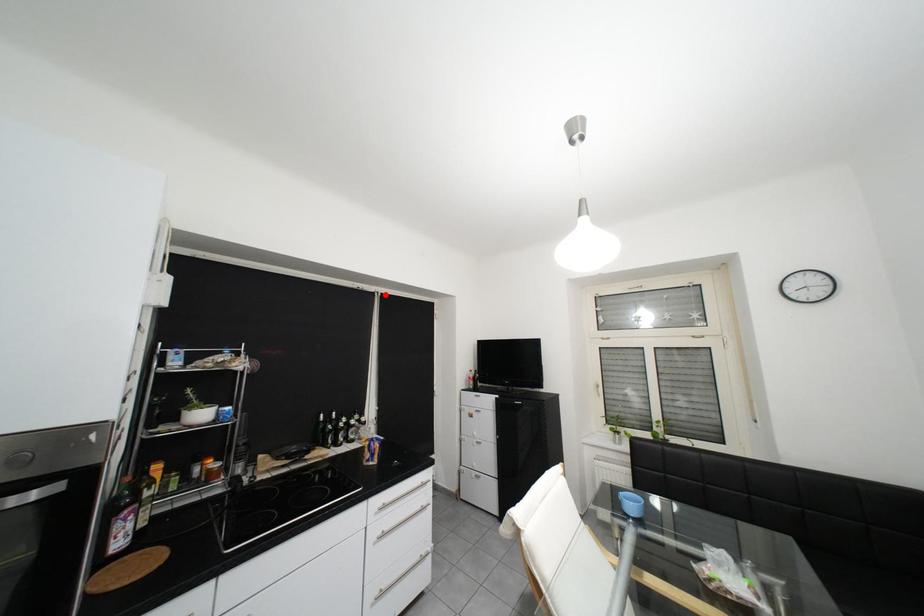
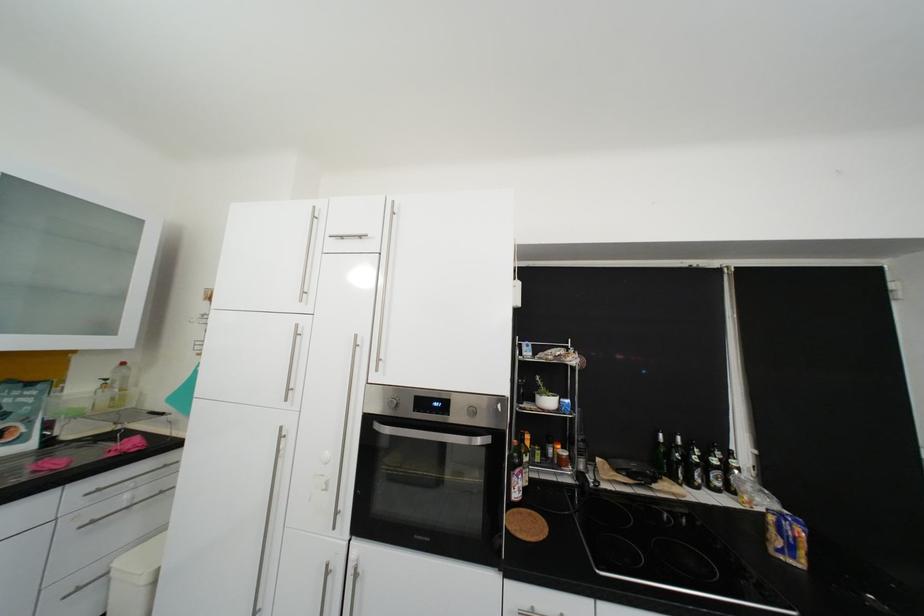
Find the pixel in the second image that matches the highlighted location in the first image.

(731, 272)